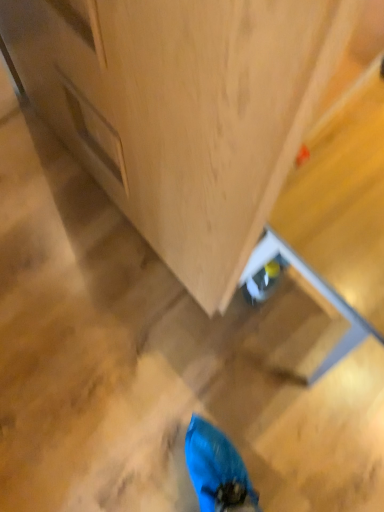
Identify the location of free space in front of wooden cabinet at lower center. (112, 336).